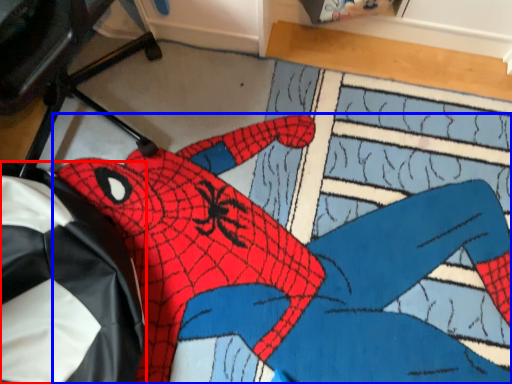
Question: Which of the following is the farthest to the observer, bean bag chair (highlighted by a red box) or person (highlighted by a blue box)?

Choices:
 (A) bean bag chair
 (B) person

Answer: (B)